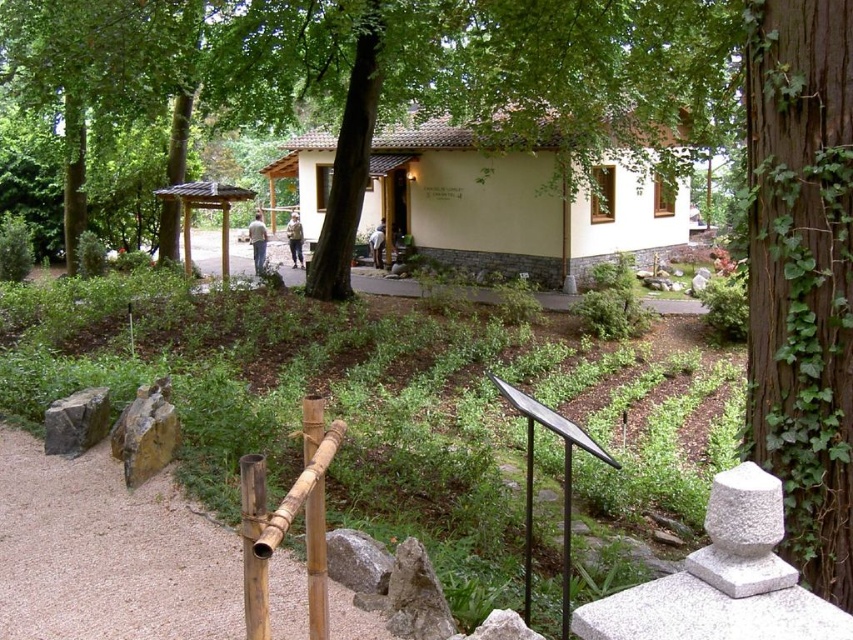
You are a landscape architect designing a new pathway. You have two materials available for the fence section of the path. The bamboo rail at lower center and the gray rough stone at lower left. Which material has a narrower width for the fence section?

The bamboo rail at lower center has a narrower width than the gray rough stone at lower left.

You are a maintenance worker needing to place a 3.5 meter long wooden plank between the bamboo rail at lower center and the gray rough stone at lower left. Can you fit the plank between them without bending it?

The bamboo rail at lower center is 3.27 meters away from the gray rough stone at lower left. Since the plank is 3.5 meters long, it is longer than the distance between them, so it cannot be placed straight between the bamboo rail at lower center and the gray rough stone at lower left without bending.